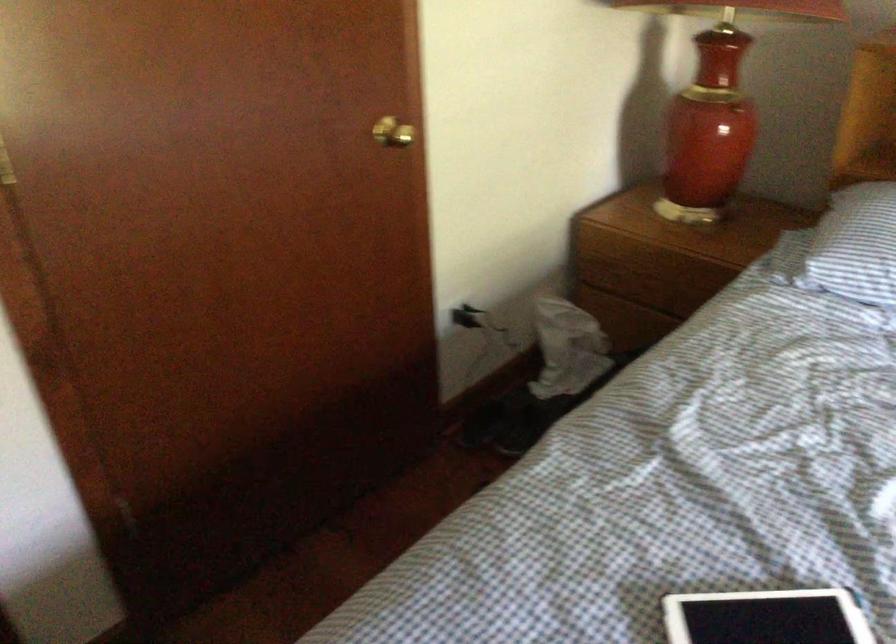
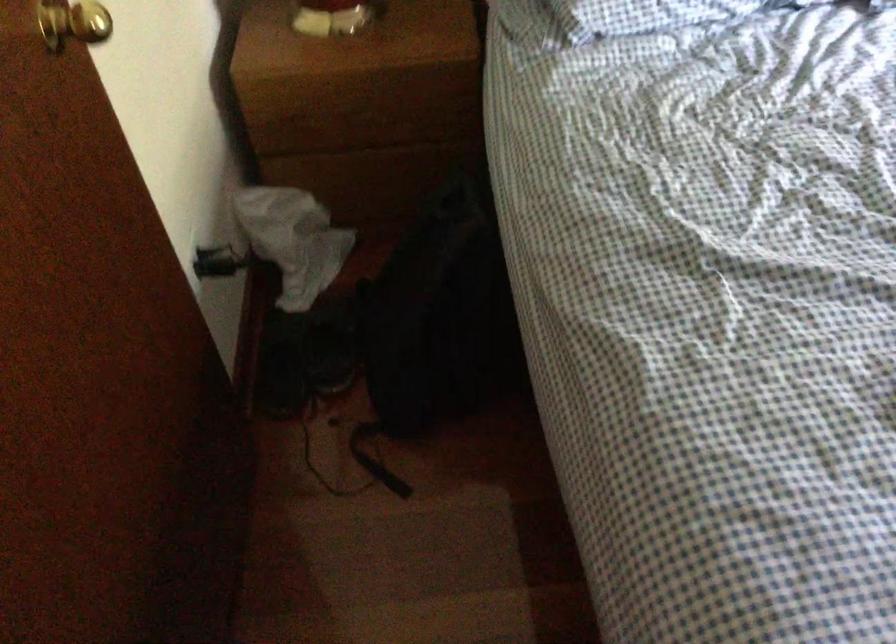
First-person continuous shooting, in which direction is the camera rotating?

The camera rotated toward right-down.